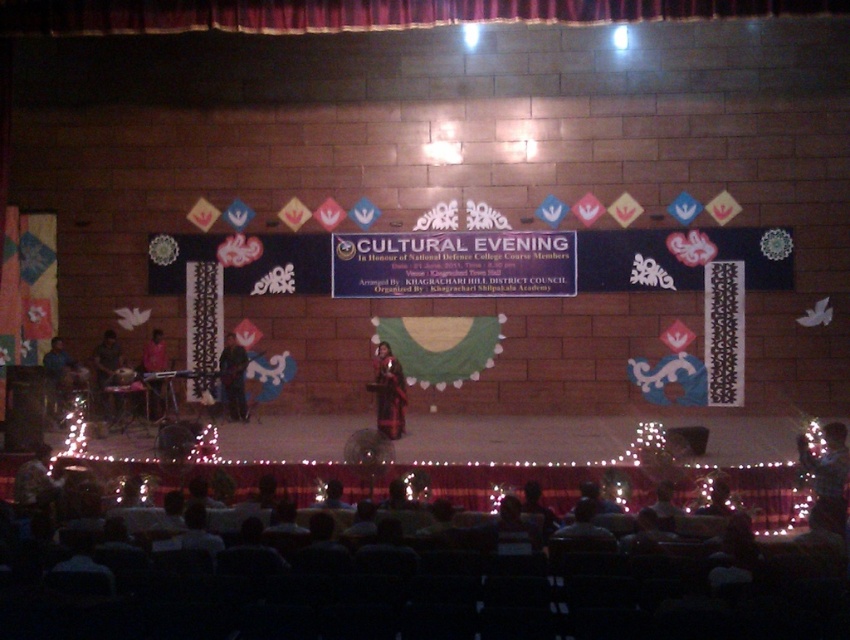
Measure the distance from silky black dress at center to dark red fabric dress at center.

6.59 meters

Who is higher up, silky black dress at center or dark red fabric dress at center?

dark red fabric dress at center

You are a GUI agent. You are given a task and a screenshot of the screen. Output one action in this format:
    pyautogui.click(x=<x>, y=<y>)
    Task: Click on the silky black dress at center
    The width and height of the screenshot is (850, 640).
    Given the screenshot: What is the action you would take?
    pyautogui.click(x=828, y=472)

Is point (823, 435) behind point (94, 374)?

No, it is not.

Does silky black dress at center appear on the left side of matte black keyboard at center?

No, silky black dress at center is not to the left of matte black keyboard at center.

The width and height of the screenshot is (850, 640). I want to click on silky black dress at center, so click(828, 472).

The height and width of the screenshot is (640, 850). I want to click on silky black dress at center, so click(828, 472).

Is point (228, 340) closer to viewer compared to point (54, 358)?

No, it is behind (54, 358).

Does dark blue fabric at center have a smaller size compared to blue fabric at stage left?

Correct, dark blue fabric at center occupies less space than blue fabric at stage left.

Locate an element on the screen. The height and width of the screenshot is (640, 850). dark blue fabric at center is located at coordinates (233, 378).